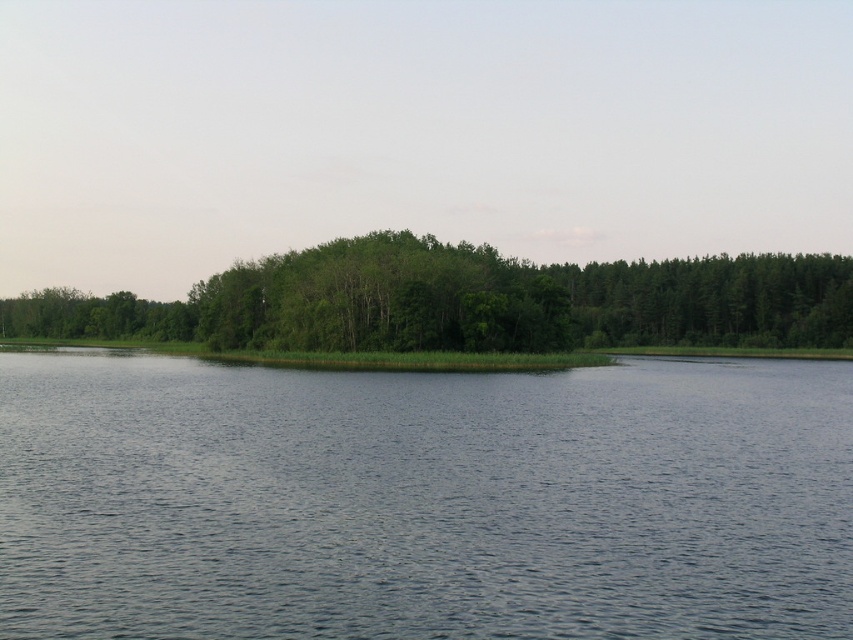
Is blue water at center smaller than green leafy trees at center?

Correct, blue water at center occupies less space than green leafy trees at center.

Does blue water at center appear under green leafy trees at center?

Yes.

Locate an element on the screen. blue water at center is located at coordinates (422, 499).

In order to click on blue water at center in this screenshot , I will do `click(422, 499)`.